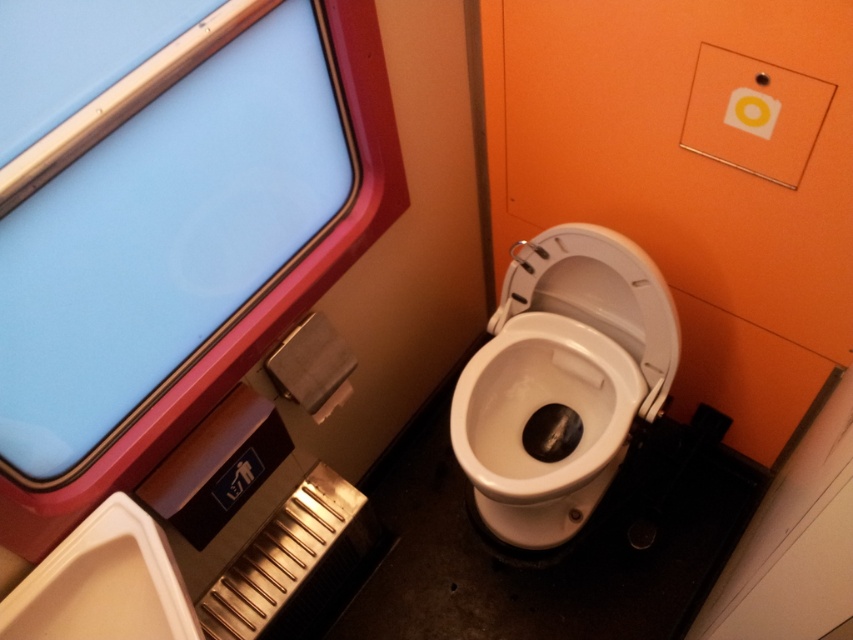
Is blue glass window at upper left positioned in front of white glossy toilet bowl at center?

Yes, it is.

Does point (216, 192) come farther from viewer compared to point (564, 346)?

No, it is not.

Where is `blue glass window at upper left`? The image size is (853, 640). blue glass window at upper left is located at coordinates (163, 240).